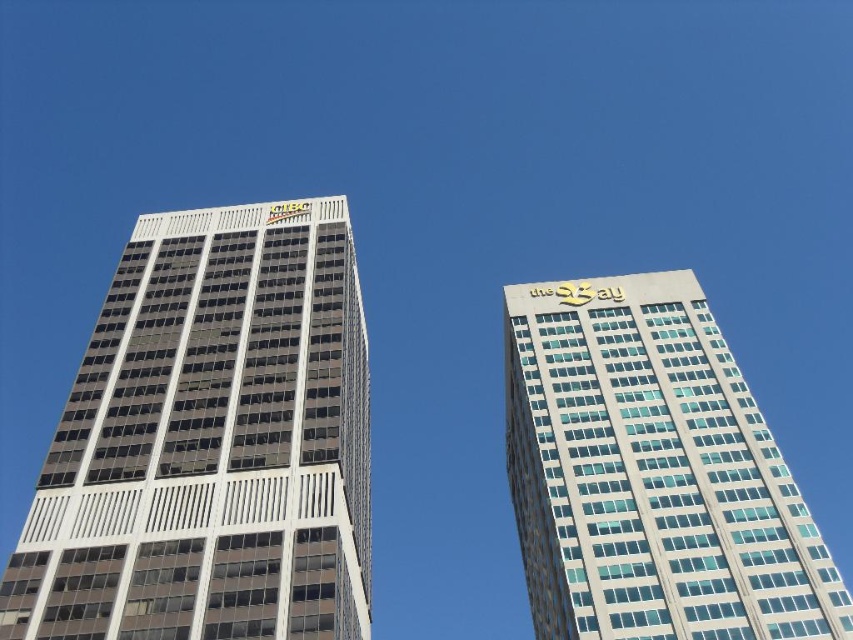
You are standing at the center of the image. Which direction should you face to see the matte glass building at left?

You should face to the left to see the matte glass building at left, as it is located at point (x=210, y=442) which is to the left side of the image.

You are an architect analyzing the two buildings in the scene. Which building has a greater width between the matte glass building at left and the white glass building at right?

The matte glass building at left has a greater width than the white glass building at right.

You are standing at the camera position and want to take a photo of the matte glass building at left. If your camera has a 50mm lens, which has a field of view of 46 degrees, will the entire building fit in the frame?

The matte glass building at left is 56.82 meters away from the camera. Using the formula for calculating field of view, the building will fit within the 46 degree field of view of a 50mm lens at this distance.